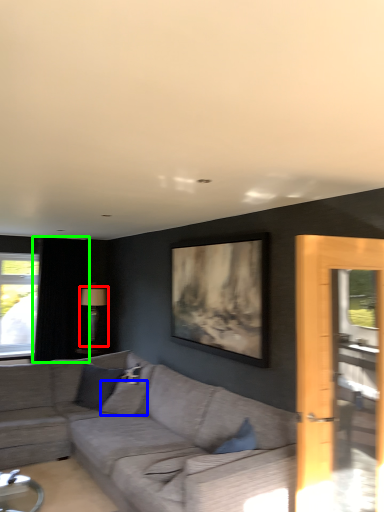
Question: Which object is the closest to the lamp (highlighted by a red box)? Choose among these: pillow (highlighted by a blue box) or curtain (highlighted by a green box).

Choices:
 (A) pillow
 (B) curtain

Answer: (B)